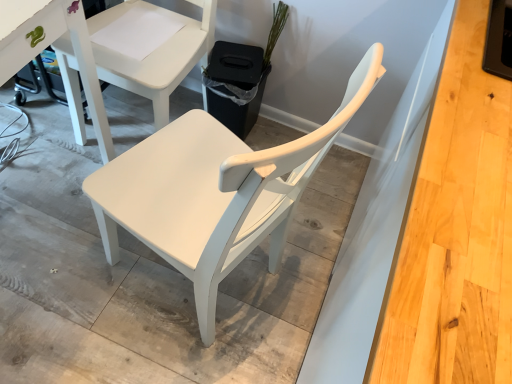
Identify the location of white matte chair at center, which is the 2th chair from bottom to top. (150, 49).

I want to click on green matte plant at upper center, so click(x=275, y=31).

Can you tell me how much white matte chair at center, positioned as the 2th chair in top-to-bottom order, and green matte plant at upper center differ in facing direction?

The facing directions of white matte chair at center, positioned as the 2th chair in top-to-bottom order, and green matte plant at upper center are 0.513 degrees apart.

Considering the positions of objects white matte chair at center, positioned as the 2th chair in top-to-bottom order, and green matte plant at upper center in the image provided, who is more to the right, white matte chair at center, positioned as the 2th chair in top-to-bottom order, or green matte plant at upper center?

green matte plant at upper center is more to the right.

Is white matte chair at center, positioned as the 2th chair in top-to-bottom order, next to green matte plant at upper center?

No, white matte chair at center, positioned as the 2th chair in top-to-bottom order, is not touching green matte plant at upper center.

Which is in front, point (364, 66) or point (278, 7)?

Positioned in front is point (364, 66).

From the image's perspective, is white matte chair at center, which is the 2th chair from bottom to top, on top of white matte chair at center, marked as the first chair in a bottom-to-top arrangement?

Yes, from the image's perspective, white matte chair at center, which is the 2th chair from bottom to top, is on top of white matte chair at center, marked as the first chair in a bottom-to-top arrangement.

Is white matte chair at center, which is the 2th chair from bottom to top, oriented away from white matte chair at center, positioned as the 2th chair in top-to-bottom order?

white matte chair at center, which is the 2th chair from bottom to top, does not have its back to white matte chair at center, positioned as the 2th chair in top-to-bottom order.

What's the angular difference between white matte chair at center, which is counted as the first chair, starting from the top, and white matte chair at center, positioned as the 2th chair in top-to-bottom order,'s facing directions?

They differ by 0.513 degrees in their facing directions.

From the picture: Can you confirm if green matte plant at upper center is thinner than white matte chair at center, which is counted as the first chair, starting from the top?

Yes, green matte plant at upper center is thinner than white matte chair at center, which is counted as the first chair, starting from the top.

Which is nearer, [273,44] or [149,92]?

Point [273,44] is positioned farther from the camera compared to point [149,92].

Is green matte plant at upper center not close to white matte chair at center, which is the 2th chair from bottom to top?

No, green matte plant at upper center is not far away from white matte chair at center, which is the 2th chair from bottom to top.

Between point (274, 38) and point (117, 240), which one is positioned in front?

The point (117, 240) is in front.

In the image, is green matte plant at upper center on the left side or the right side of white matte chair at center, marked as the first chair in a bottom-to-top arrangement?

From the image, it's evident that green matte plant at upper center is to the right of white matte chair at center, marked as the first chair in a bottom-to-top arrangement.

Does green matte plant at upper center turn towards white matte chair at center, positioned as the 2th chair in top-to-bottom order?

No.

How different are the orientations of green matte plant at upper center and white matte chair at center, positioned as the 2th chair in top-to-bottom order, in degrees?

green matte plant at upper center and white matte chair at center, positioned as the 2th chair in top-to-bottom order, are facing 0.513 degrees away from each other.

Is white matte chair at center, which is counted as the first chair, starting from the top, inside the boundaries of green matte plant at upper center, or outside?

white matte chair at center, which is counted as the first chair, starting from the top, is spatially situated outside green matte plant at upper center.

From the image's perspective, is white matte chair at center, which is counted as the first chair, starting from the top, beneath green matte plant at upper center?

Yes.

Does white matte chair at center, which is counted as the first chair, starting from the top, have a smaller size compared to green matte plant at upper center?

No, white matte chair at center, which is counted as the first chair, starting from the top, is not smaller than green matte plant at upper center.

From a real-world perspective, which object rests below the other?

white matte chair at center, which is counted as the first chair, starting from the top.

Is white matte chair at center, marked as the first chair in a bottom-to-top arrangement, not close to white matte chair at center, which is counted as the first chair, starting from the top?

That's not correct — white matte chair at center, marked as the first chair in a bottom-to-top arrangement, is a little close to white matte chair at center, which is counted as the first chair, starting from the top.

Based on their positions, is white matte chair at center, marked as the first chair in a bottom-to-top arrangement, located to the left or right of white matte chair at center, which is counted as the first chair, starting from the top?

From the image, it's evident that white matte chair at center, marked as the first chair in a bottom-to-top arrangement, is to the right of white matte chair at center, which is counted as the first chair, starting from the top.

Who is bigger, white matte chair at center, marked as the first chair in a bottom-to-top arrangement, or white matte chair at center, which is counted as the first chair, starting from the top?

With larger size is white matte chair at center, which is counted as the first chair, starting from the top.

Where is `chair that appears above the white matte chair at center, marked as the first chair in a bottom-to-top arrangement (from the image's perspective)`? Image resolution: width=512 pixels, height=384 pixels. chair that appears above the white matte chair at center, marked as the first chair in a bottom-to-top arrangement (from the image's perspective) is located at coordinates (150, 49).

Where is `the 2nd chair in front when counting from the green matte plant at upper center`? the 2nd chair in front when counting from the green matte plant at upper center is located at coordinates (214, 192).

Find the location of a particular element. chair located above the white matte chair at center, positioned as the 2th chair in top-to-bottom order (from the image's perspective) is located at coordinates (150, 49).

Looking at the image, which one is located further to white matte chair at center, positioned as the 2th chair in top-to-bottom order, white matte chair at center, which is counted as the first chair, starting from the top, or green matte plant at upper center?

green matte plant at upper center is further to white matte chair at center, positioned as the 2th chair in top-to-bottom order.

Looking at the image, which one is located closer to green matte plant at upper center, white matte chair at center, positioned as the 2th chair in top-to-bottom order, or white matte chair at center, which is the 2th chair from bottom to top?

Among the two, white matte chair at center, which is the 2th chair from bottom to top, is located nearer to green matte plant at upper center.

Considering their positions, is green matte plant at upper center positioned closer to white matte chair at center, which is the 2th chair from bottom to top, than white matte chair at center, positioned as the 2th chair in top-to-bottom order?

Among the two, green matte plant at upper center is located nearer to white matte chair at center, which is the 2th chair from bottom to top.

Looking at this image, from the image, which object appears to be nearer to white matte chair at center, which is counted as the first chair, starting from the top, white matte chair at center, positioned as the 2th chair in top-to-bottom order, or green matte plant at upper center?

green matte plant at upper center is closer to white matte chair at center, which is counted as the first chair, starting from the top.

Looking at this image, estimate the real-world distances between objects in this image. Which object is further from green matte plant at upper center, white matte chair at center, which is the 2th chair from bottom to top, or white matte chair at center, marked as the first chair in a bottom-to-top arrangement?

The object further to green matte plant at upper center is white matte chair at center, marked as the first chair in a bottom-to-top arrangement.

Looking at the image, which one is located further to white matte chair at center, marked as the first chair in a bottom-to-top arrangement, green matte plant at upper center or white matte chair at center, which is counted as the first chair, starting from the top?

green matte plant at upper center lies further to white matte chair at center, marked as the first chair in a bottom-to-top arrangement, than the other object.

You are a GUI agent. You are given a task and a screenshot of the screen. Output one action in this format:
    pyautogui.click(x=<x>, y=<y>)
    Task: Click on the chair between green matte plant at upper center and white matte chair at center, marked as the first chair in a bottom-to-top arrangement, in the vertical direction
    This screenshot has width=512, height=384.
    Given the screenshot: What is the action you would take?
    pyautogui.click(x=150, y=49)